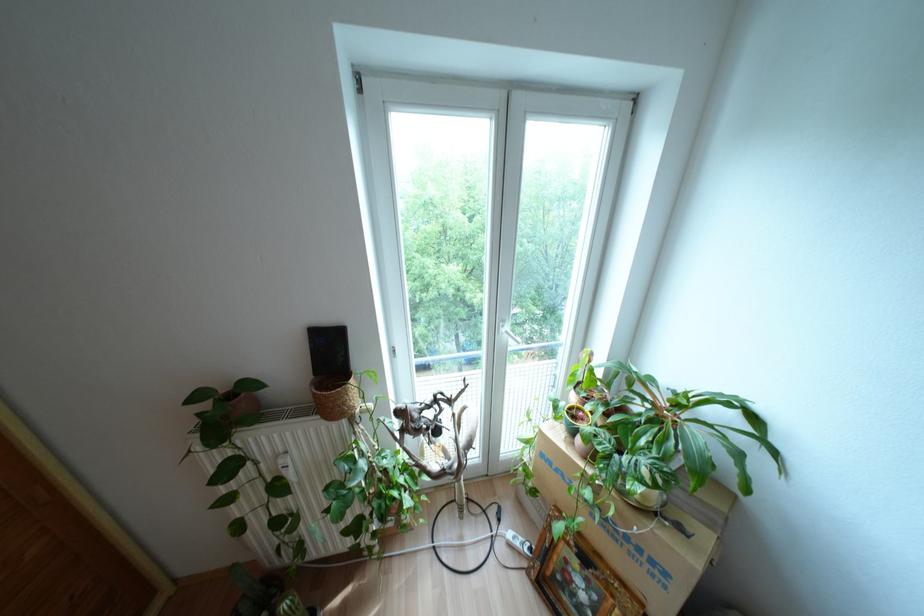
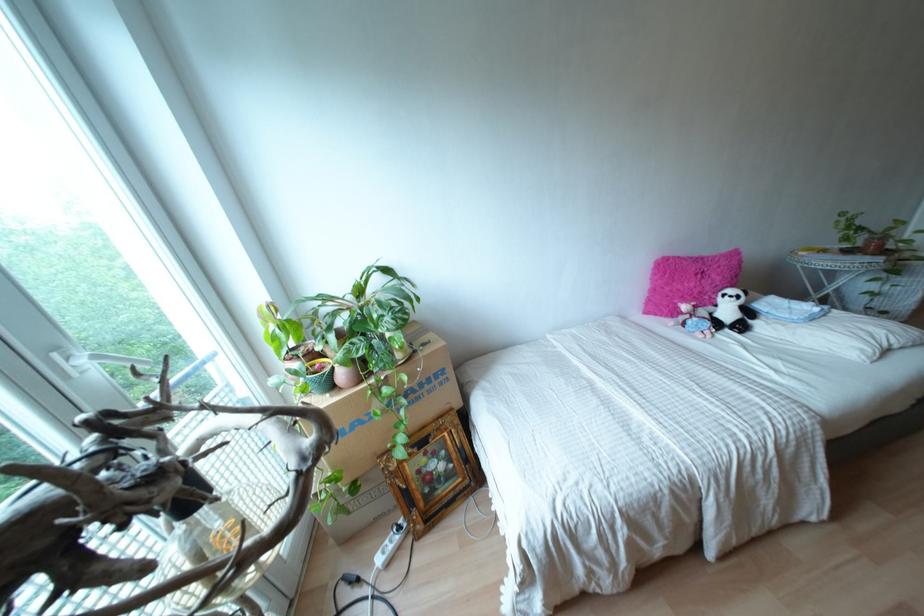
Find the pixel in the second image that matches point 638,549 in the first image.

(428, 379)